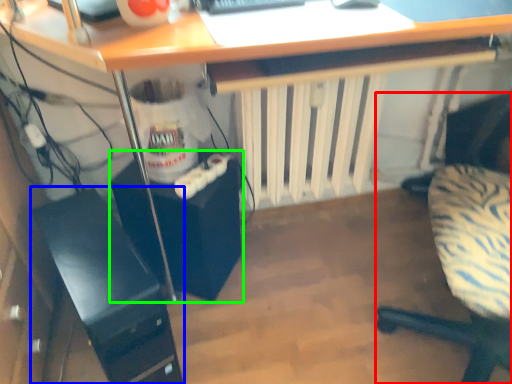
Question: Based on their relative distances, which object is nearer to chair (highlighted by a red box)? Choose from computer tower (highlighted by a blue box) and computer tower (highlighted by a green box).

Choices:
 (A) computer tower
 (B) computer tower

Answer: (B)